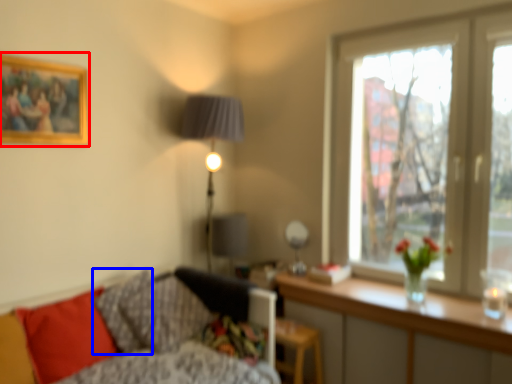
Question: Which object appears farthest to the camera in this image, picture frame (highlighted by a red box) or pillow (highlighted by a blue box)?

Choices:
 (A) picture frame
 (B) pillow

Answer: (B)